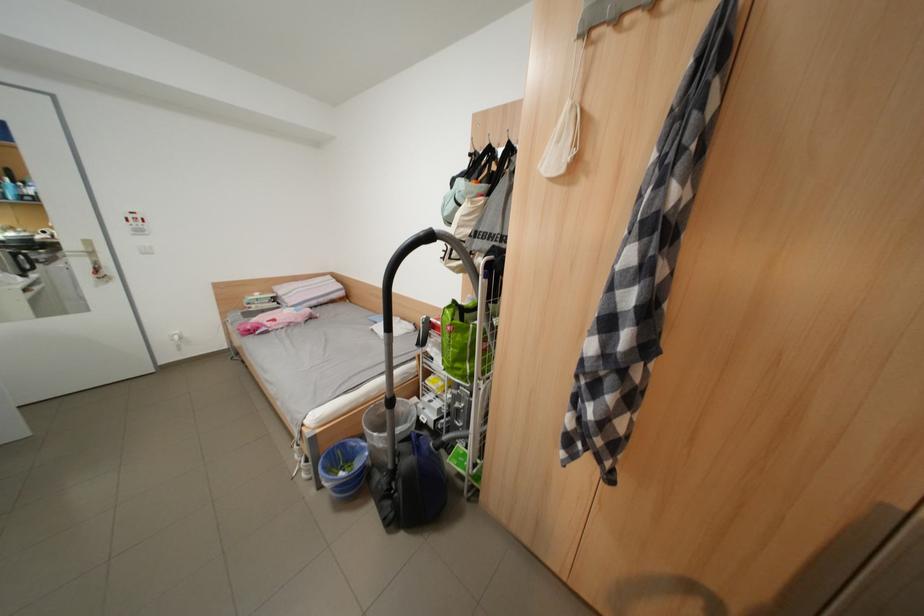
You are a GUI agent. You are given a task and a screenshot of the screen. Output one action in this format:
    pyautogui.click(x=<x>, y=<y>)
    Task: Click on the black vacuum handle
    
    Given the screenshot: What is the action you would take?
    pyautogui.click(x=407, y=419)